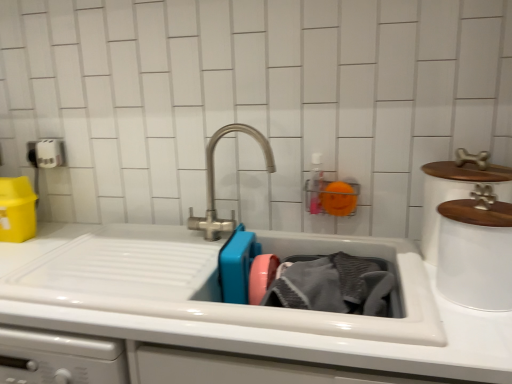
Question: Is gray textured towel at sink directly adjacent to white matte toilet paper at upper left?

Choices:
 (A) yes
 (B) no

Answer: (B)

Question: Does gray textured towel at sink appear on the right side of white matte toilet paper at upper left?

Choices:
 (A) yes
 (B) no

Answer: (A)

Question: Is gray textured towel at sink taller than white matte toilet paper at upper left?

Choices:
 (A) no
 (B) yes

Answer: (B)

Question: Is gray textured towel at sink smaller than white matte toilet paper at upper left?

Choices:
 (A) no
 (B) yes

Answer: (A)

Question: Is gray textured towel at sink to the left of white matte toilet paper at upper left from the viewer's perspective?

Choices:
 (A) no
 (B) yes

Answer: (A)

Question: From a real-world perspective, is satin nickel faucet at center physically located above or below white matte pet food container at upper right, which ranks as the second appliance in back-to-front order?

Choices:
 (A) above
 (B) below

Answer: (A)

Question: Relative to white matte pet food container at upper right, which ranks as the second appliance in back-to-front order, is satin nickel faucet at center in front or behind?

Choices:
 (A) behind
 (B) front

Answer: (A)

Question: Visually, is satin nickel faucet at center positioned to the left or to the right of white matte pet food container at upper right, which is counted as the 1th appliance, starting from the front?

Choices:
 (A) left
 (B) right

Answer: (A)

Question: From the image's perspective, is satin nickel faucet at center above or below white matte pet food container at upper right, which ranks as the second appliance in back-to-front order?

Choices:
 (A) below
 (B) above

Answer: (B)

Question: Is white matte pet food container at upper right, which is counted as the 1th appliance, starting from the front, in front of or behind white ceramic container at upper right, the 1th appliance from the back, in the image?

Choices:
 (A) front
 (B) behind

Answer: (A)

Question: Is white matte pet food container at upper right, which is counted as the 1th appliance, starting from the front, inside or outside of white ceramic container at upper right, the second appliance when ordered from front to back?

Choices:
 (A) outside
 (B) inside

Answer: (A)

Question: From their relative heights in the image, would you say white matte pet food container at upper right, which ranks as the second appliance in back-to-front order, is taller or shorter than white ceramic container at upper right, the second appliance when ordered from front to back?

Choices:
 (A) tall
 (B) short

Answer: (B)

Question: From a real-world perspective, is white matte pet food container at upper right, which is counted as the 1th appliance, starting from the front, physically located above or below white ceramic container at upper right, the second appliance when ordered from front to back?

Choices:
 (A) below
 (B) above

Answer: (A)

Question: From the image's perspective, is gray textured towel at sink located above or below white matte toilet paper at upper left?

Choices:
 (A) above
 (B) below

Answer: (B)

Question: Considering the positions of gray textured towel at sink and white matte toilet paper at upper left in the image, is gray textured towel at sink wider or thinner than white matte toilet paper at upper left?

Choices:
 (A) thin
 (B) wide

Answer: (B)